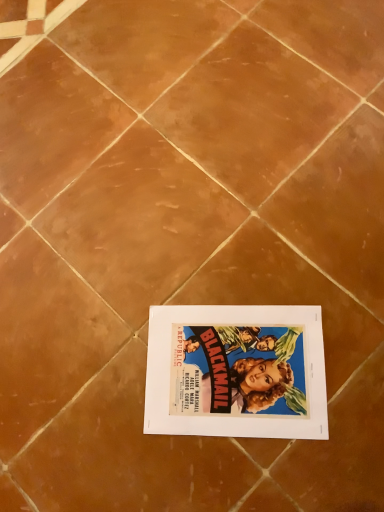
This screenshot has width=384, height=512. In order to click on free space behind white paper at center in this screenshot , I will do `click(181, 251)`.